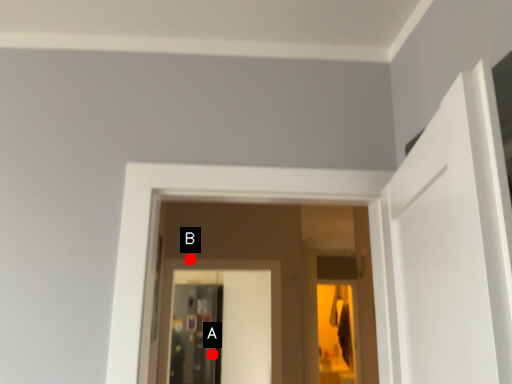
Question: Two points are circled on the image, labeled by A and B beside each circle. Which point is closer to the camera?

Choices:
 (A) A is closer
 (B) B is closer

Answer: (B)